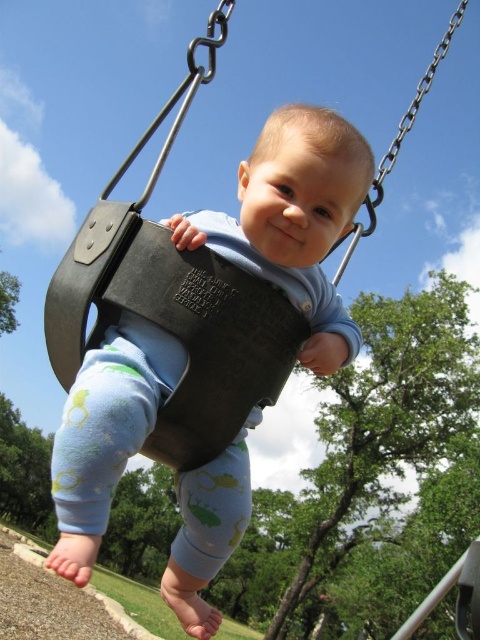
Looking at this image, you are a parent checking the swing set in the park. You see the matte black swing at center and the metallic swing seat at center. Which one has a smaller width?

The matte black swing at center is thinner than the metallic swing seat at center, so the matte black swing at center has a smaller width.

You are a parent checking the swing setup for your baby. You see the matte black swing at center and the metallic swing seat at center. Which one is located below the other?

The matte black swing at center is positioned under the metallic swing seat at center, so the matte black swing is below the metallic swing seat.